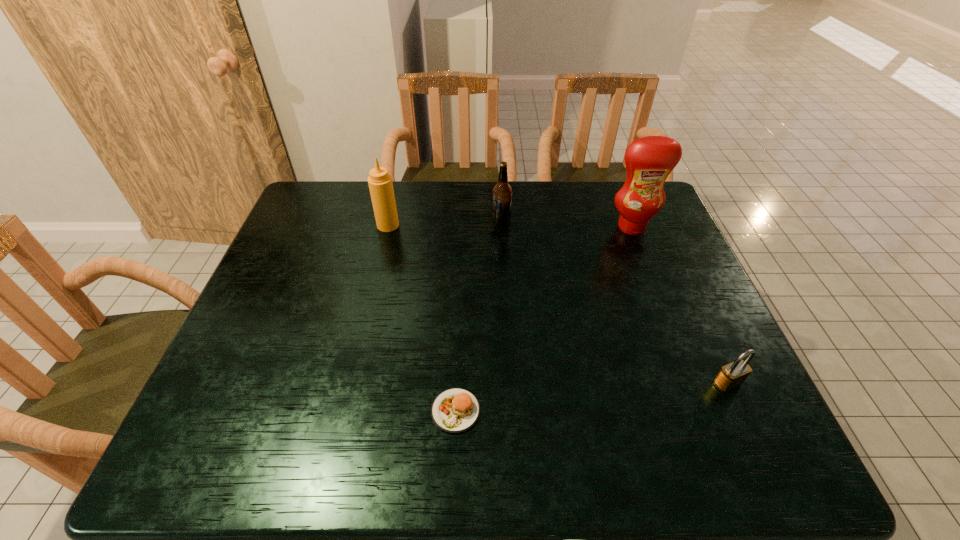
Where is `vacant space that is in between the second shortest object and the taller condiment`? The image size is (960, 540). vacant space that is in between the second shortest object and the taller condiment is located at coordinates click(x=680, y=305).

Where is `unoccupied position between the patty and the left condiment`? unoccupied position between the patty and the left condiment is located at coordinates (421, 318).

Where is `free area in between the padlock and the shortest object`? free area in between the padlock and the shortest object is located at coordinates (591, 397).

You are a GUI agent. You are given a task and a screenshot of the screen. Output one action in this format:
    pyautogui.click(x=<x>, y=<y>)
    Task: Click on the vacant point located between the shortest object and the shorter condiment
    This screenshot has width=960, height=540.
    Given the screenshot: What is the action you would take?
    pyautogui.click(x=421, y=318)

The width and height of the screenshot is (960, 540). I want to click on free space between the padlock and the left condiment, so click(558, 304).

Image resolution: width=960 pixels, height=540 pixels. In order to click on object that stands as the fourth closest to the second shortest object in this screenshot , I will do pos(380,183).

Locate which object ranks third in proximity to the right condiment. Please provide its 2D coordinates. Your answer should be formatted as a tuple, i.e. [(x, y)], where the tuple contains the x and y coordinates of a point satisfying the conditions above.

[(380, 183)]

Where is `free space that satisfies the following two spatial constraints: 1. on the label of the third object from left to right; 2. on the left side of the second shortest object`? free space that satisfies the following two spatial constraints: 1. on the label of the third object from left to right; 2. on the left side of the second shortest object is located at coordinates (510, 383).

Where is `vacant space that satisfies the following two spatial constraints: 1. on the label of the padlock; 2. on the right side of the third object from right to left`? This screenshot has width=960, height=540. vacant space that satisfies the following two spatial constraints: 1. on the label of the padlock; 2. on the right side of the third object from right to left is located at coordinates (510, 383).

I want to click on free point that satisfies the following two spatial constraints: 1. on the back side of the padlock; 2. on the right side of the second object from left to right, so click(457, 383).